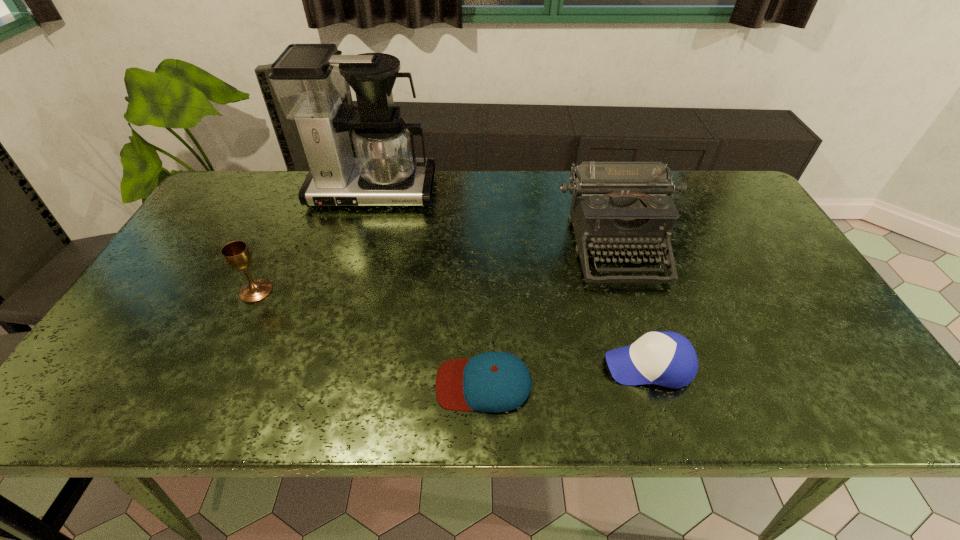
At what (x,y) coordinates should I click in order to perform the action: click on coffee maker. Please return your answer as a coordinate pair (x, y). This screenshot has width=960, height=540. Looking at the image, I should click on (309, 81).

This screenshot has width=960, height=540. What are the coordinates of `typewriter` in the screenshot? It's located at (616, 205).

Locate an element on the screen. the third tallest object is located at coordinates (237, 255).

Identify the location of the taller baseball cap. (665, 358).

Where is `the second shortest object`? the second shortest object is located at coordinates (665, 358).

Identify the location of the shortest object. This screenshot has height=540, width=960. (493, 382).

Where is `the left baseball cap`? The height and width of the screenshot is (540, 960). the left baseball cap is located at coordinates (493, 382).

I want to click on vacant space located 0.120m at the front of the coffee maker where the controls are located, so click(x=358, y=240).

You are a GUI agent. You are given a task and a screenshot of the screen. Output one action in this format:
    pyautogui.click(x=<x>, y=<y>)
    Task: Click on the blank space located on the typing side of the fourth shortest object
    The height and width of the screenshot is (540, 960).
    Given the screenshot: What is the action you would take?
    pyautogui.click(x=659, y=381)

Image resolution: width=960 pixels, height=540 pixels. What are the coordinates of `free space located on the back of the third tallest object` in the screenshot? It's located at (282, 237).